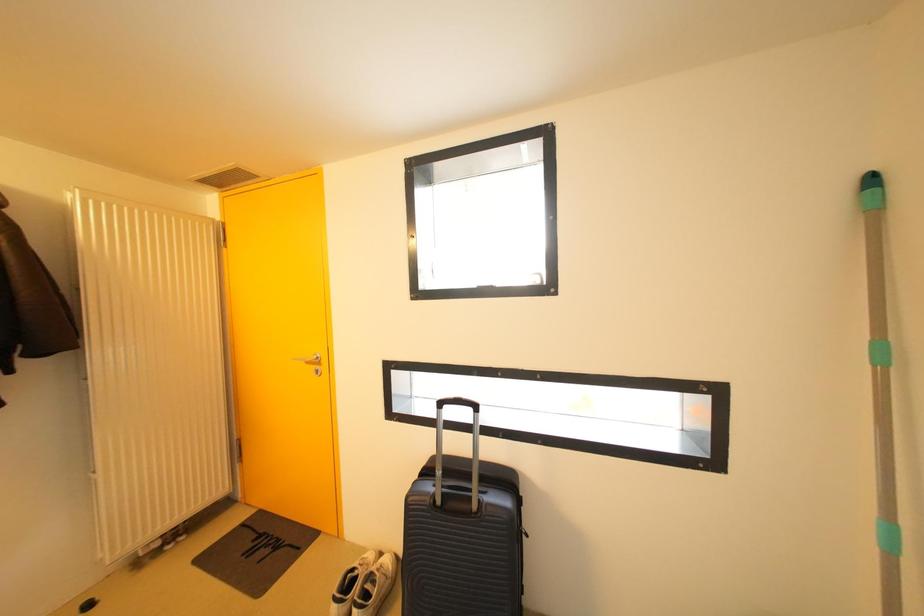
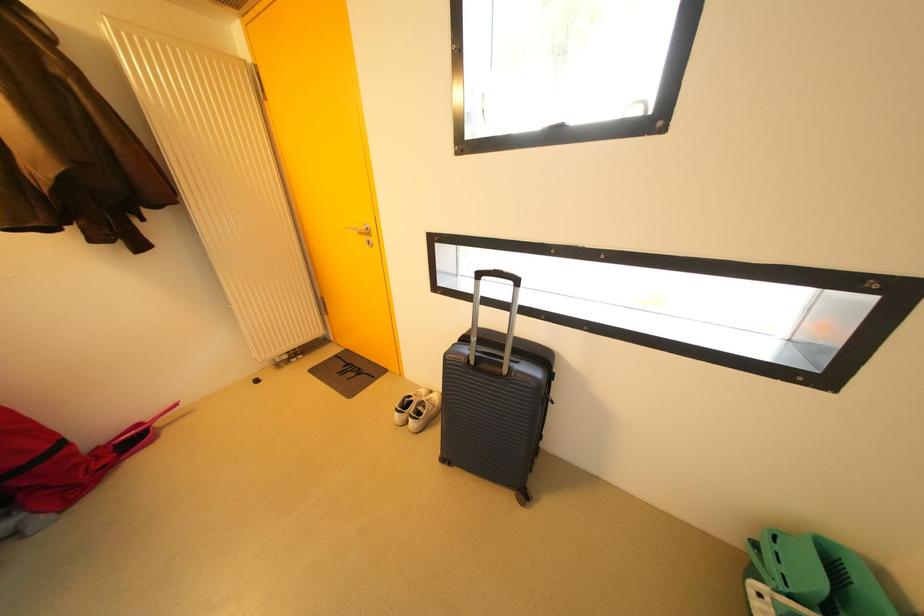
The images are taken continuously from a first-person perspective. In which direction are you moving?

The cameraman walked toward right, forward.